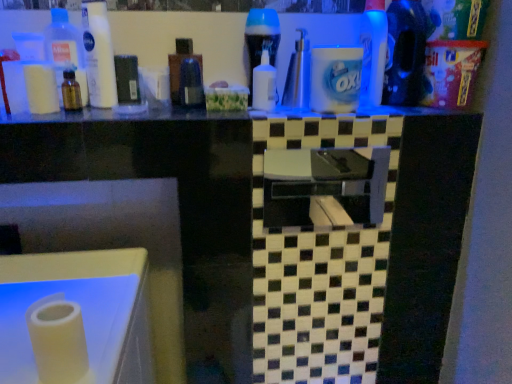
Identify the location of free point in front of white matte bottle at center, which is the second bottle in right-to-left order. (256, 112).